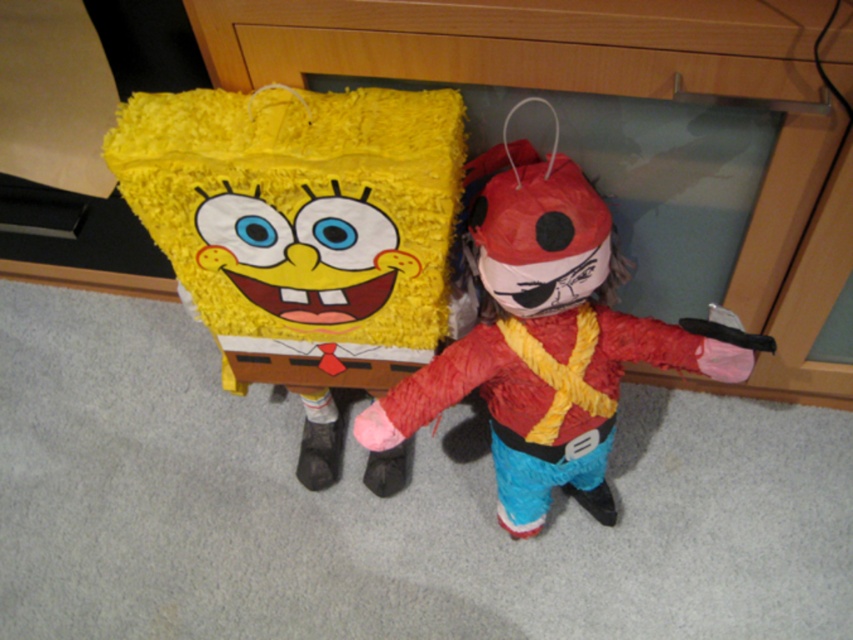
You are a guest at a party and want to grab a treat from the wooden dresser at center. However, the matte yellow sponge at center is blocking your path. Can you walk around the sponge to reach the dresser?

The wooden dresser at center is behind the matte yellow sponge at center, so you can walk around the sponge to reach the dresser.

You are a party planner setting up decorations. You have a wooden dresser at center and a red felt pirate at center. Which object should you place closer to the entrance to ensure both are visible from the entrance without blocking each other?

The wooden dresser at center is larger in size than the red felt pirate at center, so you should place the smaller red felt pirate at center closer to the entrance to avoid blocking the view of the larger wooden dresser at center.

You are a party planner arranging decorations. You have two pi?atras in the room. The matte yellow sponge at center and the red felt pirate at center. Which one is positioned higher in the room?

The matte yellow sponge at center is located above the red felt pirate at center, so it is positioned higher in the room.